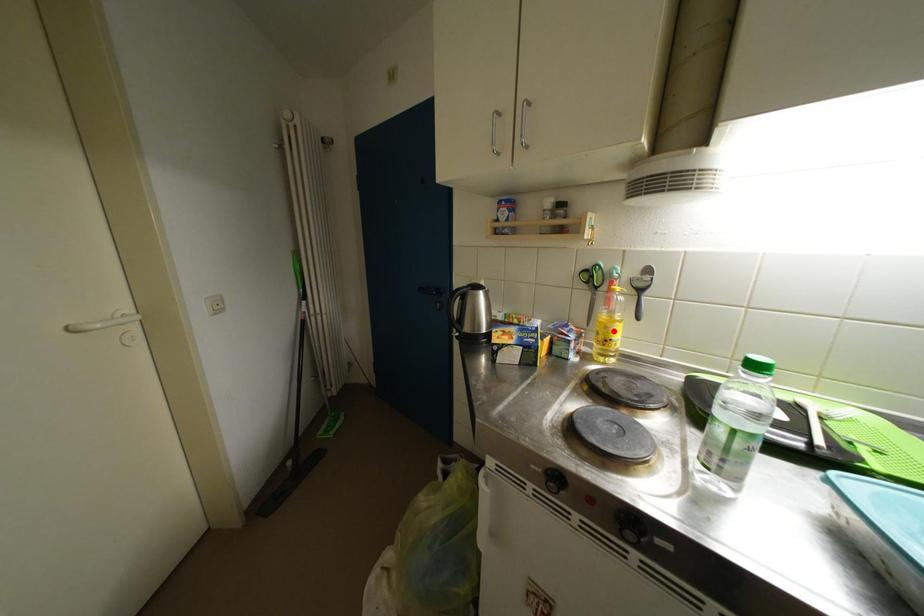
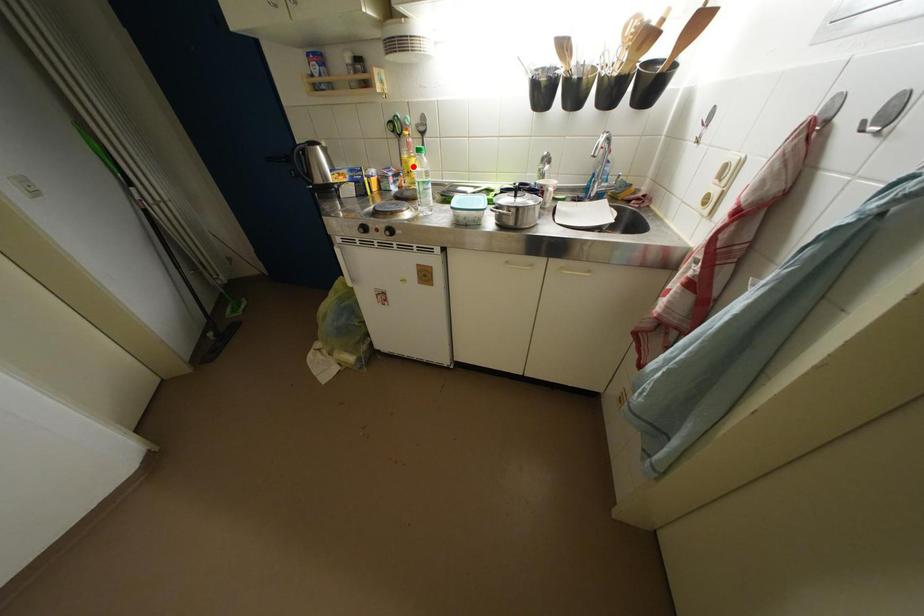
I am providing you with two images of the same scene from different viewpoints. A red point is marked on the first image and another point is marked on the second image. Are the points marked in image1 and image2 representing the same 3D position?

Yes